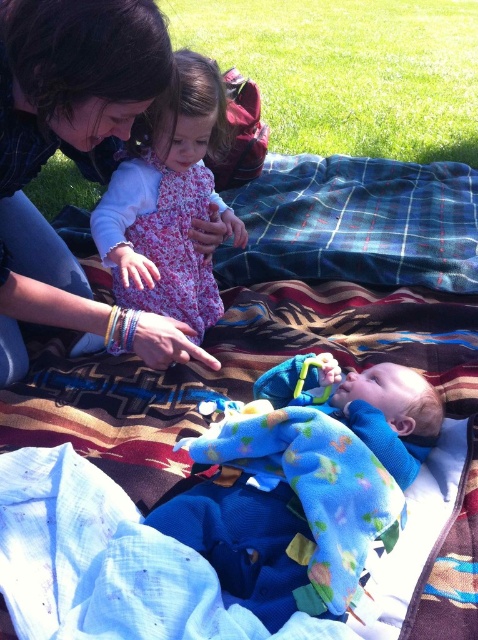
Describe the element at coordinates (73, 157) in the screenshot. I see `matte black hair at upper left` at that location.

Locate an element on the screen. matte black hair at upper left is located at coordinates (73, 157).

Looking at this image, is soft blue plush toy at center to the right of floral dress at upper center from the viewer's perspective?

Indeed, soft blue plush toy at center is positioned on the right side of floral dress at upper center.

Is soft blue plush toy at center shorter than floral dress at upper center?

Correct, soft blue plush toy at center is not as tall as floral dress at upper center.

Does point (308, 474) lie behind point (161, 99)?

No, it is not.

I want to click on soft blue plush toy at center, so click(305, 486).

Between soft blue plush toy at center and matte black hair at upper left, which one appears on the left side from the viewer's perspective?

From the viewer's perspective, matte black hair at upper left appears more on the left side.

Image resolution: width=478 pixels, height=640 pixels. Describe the element at coordinates (305, 486) in the screenshot. I see `soft blue plush toy at center` at that location.

Locate an element on the screen. soft blue plush toy at center is located at coordinates point(305,486).